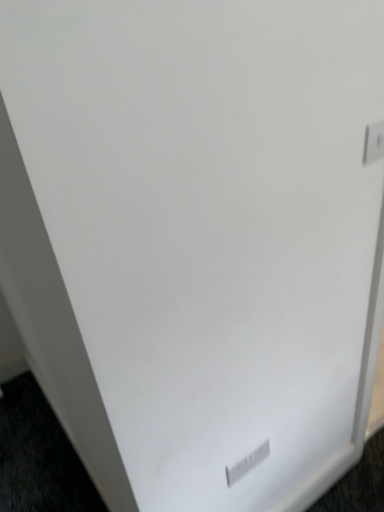
Question: Is white plastic electric outlet at lower center, which appears as the 2th electric outlet when viewed from the right, further to camera compared to white plastic electric outlet at upper right, the 1th electric outlet in the right-to-left sequence?

Choices:
 (A) yes
 (B) no

Answer: (A)

Question: Could you tell me if white plastic electric outlet at lower center, which is counted as the second electric outlet, starting from the top, is facing white plastic electric outlet at upper right, marked as the 1th electric outlet in a top-to-bottom arrangement?

Choices:
 (A) no
 (B) yes

Answer: (A)

Question: Considering the relative sizes of white plastic electric outlet at lower center, positioned as the 1th electric outlet in left-to-right order, and white plastic electric outlet at upper right, positioned as the second electric outlet in left-to-right order, in the image provided, is white plastic electric outlet at lower center, positioned as the 1th electric outlet in left-to-right order, bigger than white plastic electric outlet at upper right, positioned as the second electric outlet in left-to-right order,?

Choices:
 (A) yes
 (B) no

Answer: (A)

Question: Is white plastic electric outlet at lower center, acting as the first electric outlet starting from the back, closer to the viewer compared to white plastic electric outlet at upper right, the second electric outlet in the bottom-to-top sequence?

Choices:
 (A) yes
 (B) no

Answer: (B)

Question: Is white plastic electric outlet at lower center, positioned as the 2th electric outlet in front-to-back order, oriented away from white plastic electric outlet at upper right, which is the 1th electric outlet from front to back?

Choices:
 (A) no
 (B) yes

Answer: (A)

Question: Does white plastic electric outlet at lower center, which is counted as the second electric outlet, starting from the top, have a greater height compared to white plastic electric outlet at upper right, the second electric outlet viewed from the back?

Choices:
 (A) no
 (B) yes

Answer: (B)

Question: Does white plastic electric outlet at upper right, which is the 1th electric outlet from front to back, have a greater height compared to white plastic electric outlet at lower center, which is counted as the second electric outlet, starting from the top?

Choices:
 (A) yes
 (B) no

Answer: (B)

Question: Can you confirm if white plastic electric outlet at upper right, the 1th electric outlet in the right-to-left sequence, is shorter than white plastic electric outlet at lower center, arranged as the 1th electric outlet when ordered from the bottom?

Choices:
 (A) yes
 (B) no

Answer: (A)

Question: From the image's perspective, is white plastic electric outlet at upper right, the second electric outlet viewed from the back, beneath white plastic electric outlet at lower center, arranged as the 1th electric outlet when ordered from the bottom?

Choices:
 (A) no
 (B) yes

Answer: (A)

Question: Can you confirm if white plastic electric outlet at upper right, the 1th electric outlet in the right-to-left sequence, is smaller than white plastic electric outlet at lower center, which appears as the 2th electric outlet when viewed from the right?

Choices:
 (A) no
 (B) yes

Answer: (B)

Question: Is white plastic electric outlet at upper right, positioned as the second electric outlet in left-to-right order, positioned with its back to white plastic electric outlet at lower center, arranged as the 1th electric outlet when ordered from the bottom?

Choices:
 (A) yes
 (B) no

Answer: (B)

Question: Is white plastic electric outlet at upper right, the second electric outlet in the bottom-to-top sequence, located outside white plastic electric outlet at lower center, which is counted as the second electric outlet, starting from the top?

Choices:
 (A) no
 (B) yes

Answer: (B)

Question: Based on their positions, is white plastic electric outlet at lower center, which appears as the 2th electric outlet when viewed from the right, located to the left or right of white plastic electric outlet at upper right, marked as the 1th electric outlet in a top-to-bottom arrangement?

Choices:
 (A) right
 (B) left

Answer: (B)